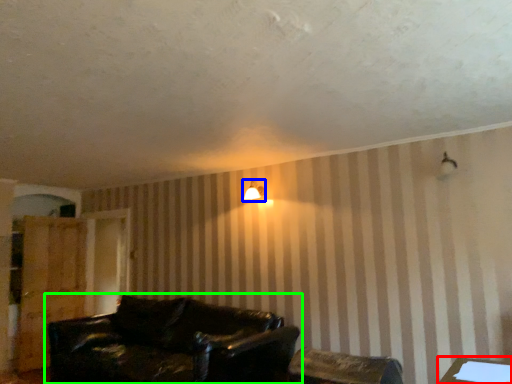
Question: Considering the real-world distances, which object is closest to table (highlighted by a red box)? lamp (highlighted by a blue box) or studio couch (highlighted by a green box).

Choices:
 (A) lamp
 (B) studio couch

Answer: (B)